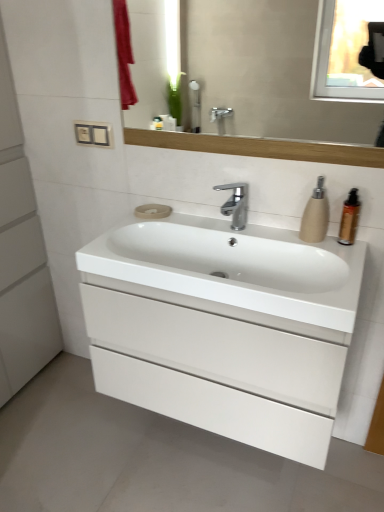
Where is `space that is in front of matte beige soap dispenser at right`? The height and width of the screenshot is (512, 384). space that is in front of matte beige soap dispenser at right is located at coordinates (339, 253).